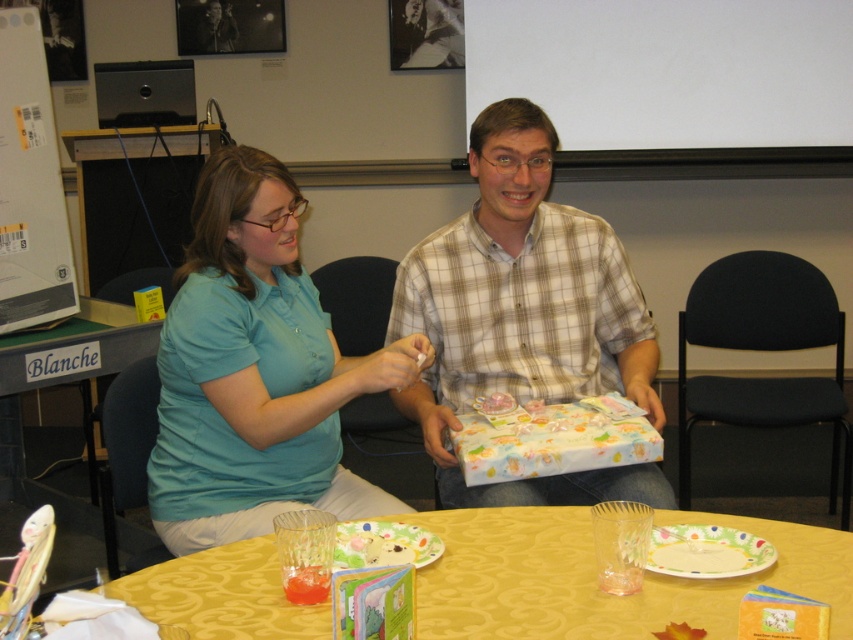
You are standing in front of the table where the two people are sitting. There is a point at coordinates [202,196] on the table. If you want to place a 1.5 meter long object on the table, will it fit from your current position to that point?

The distance from your current position to the point at [202,196] is 1.62 meters. Since the object is 1.5 meters long, it will fit as the distance is longer than the object.

You are a photographer trying to capture a clear shot of the matte blue shirt at left and the yellow fabric table at lower center. Since you want both subjects to be in focus, which one should you position closer to the camera to ensure depth of field?

The matte blue shirt at left is in front of the yellow fabric table at lower center, so positioning the matte blue shirt at left closer to the camera will help keep both in focus as they are already layered with the shirt being closer.